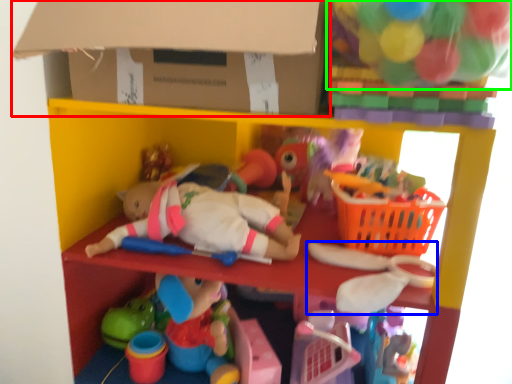
Question: Estimate the real-world distances between objects in this image. Which object is farther from cardboard box (highlighted by a red box), toy (highlighted by a blue box) or toy (highlighted by a green box)?

Choices:
 (A) toy
 (B) toy

Answer: (A)